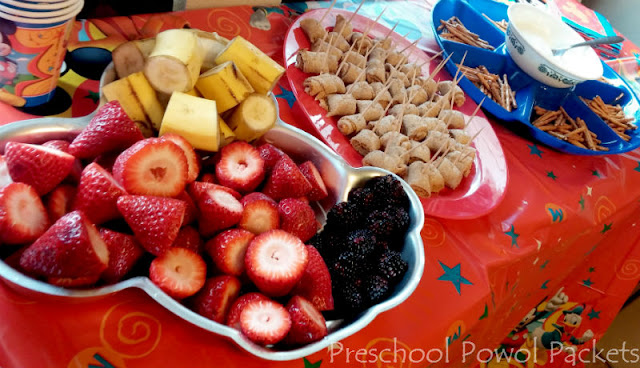
Identify the location of white bowl, shaped like mickey mouse head. (401, 294).